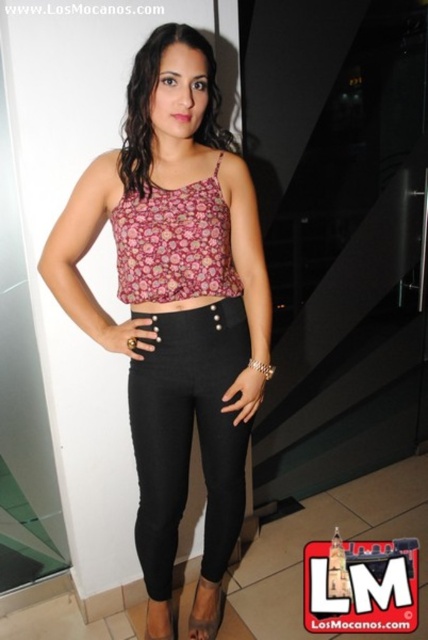
Can you confirm if floral fabric top at center is positioned below floral-patterned fabric crop top at center?

Correct, floral fabric top at center is located below floral-patterned fabric crop top at center.

Is point (148, 552) farther from camera compared to point (174, 220)?

Yes, point (148, 552) is behind point (174, 220).

This screenshot has width=428, height=640. What are the coordinates of `floral fabric top at center` in the screenshot? It's located at (175, 300).

Which of these two, black matte leggings at center or black leather sandal at lower center, stands shorter?

black leather sandal at lower center

Which is in front, point (169, 493) or point (152, 637)?

Point (169, 493)

Measure the distance between black matte leggings at center and camera.

The distance of black matte leggings at center from camera is 1.46 meters.

Where is `black matte leggings at center`? black matte leggings at center is located at coordinates (187, 435).

Does leather sandal at lower center have a lesser height compared to black leather sandal at lower center?

Incorrect, leather sandal at lower center's height does not fall short of black leather sandal at lower center's.

Does leather sandal at lower center have a smaller size compared to black leather sandal at lower center?

Incorrect, leather sandal at lower center is not smaller in size than black leather sandal at lower center.

Does point (190, 614) come closer to viewer compared to point (166, 632)?

No, (190, 614) is behind (166, 632).

This screenshot has width=428, height=640. I want to click on leather sandal at lower center, so click(205, 611).